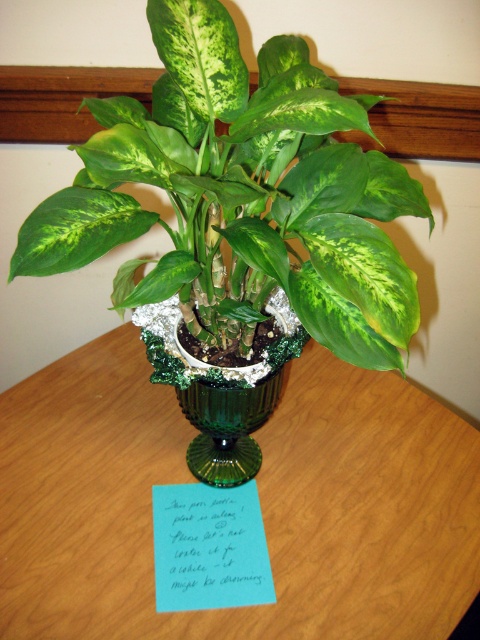
Does wooden table at center have a smaller size compared to blue paper note at center?

Actually, wooden table at center might be larger than blue paper note at center.

Does point (169, 465) come behind point (163, 598)?

Yes, it is behind point (163, 598).

Find the location of a particular element. Image resolution: width=480 pixels, height=640 pixels. wooden table at center is located at coordinates (260, 500).

Who is lower down, green glossy leafy plant at center or green textured vase at center?

green textured vase at center is below.

Can you confirm if green glossy leafy plant at center is thinner than green textured vase at center?

Incorrect, green glossy leafy plant at center's width is not less than green textured vase at center's.

Does point (180, 221) lie behind point (254, 404)?

No, it is not.

The image size is (480, 640). Identify the location of green glossy leafy plant at center. (240, 195).

In the scene shown: Can you confirm if green glossy leafy plant at center is smaller than blue paper note at center?

No, green glossy leafy plant at center is not smaller than blue paper note at center.

Is green glossy leafy plant at center below blue paper note at center?

No.

Where is `green glossy leafy plant at center`? This screenshot has height=640, width=480. green glossy leafy plant at center is located at coordinates (240, 195).